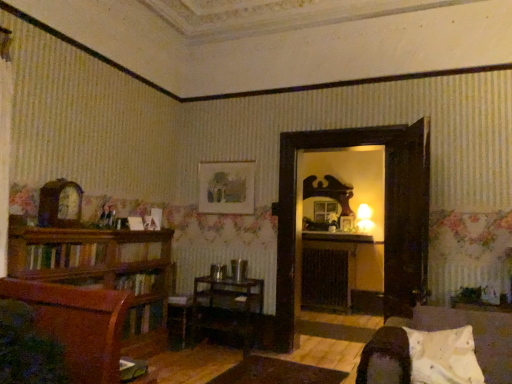
Question: Choose the correct answer: Is white soft pillow at lower right inside wooden table at center or outside it?

Choices:
 (A) outside
 (B) inside

Answer: (A)

Question: Is point (457, 380) positioned closer to the camera than point (238, 319)?

Choices:
 (A) closer
 (B) farther

Answer: (A)

Question: Estimate the real-world distances between objects in this image. Which object is closer to the white soft pillow at lower right?

Choices:
 (A) black matte fireplace at center
 (B) mahogany wood bookshelf at left
 (C) velvet dark brown chair at lower right
 (D) wooden table at center
 (E) wooden armchair at center

Answer: (C)

Question: Considering the real-world distances, which object is farthest from the wooden table at center?

Choices:
 (A) black matte fireplace at center
 (B) wooden armchair at center
 (C) matte paper picture frame at upper center
 (D) mahogany wood bookshelf at left
 (E) velvet dark brown chair at lower right

Answer: (E)